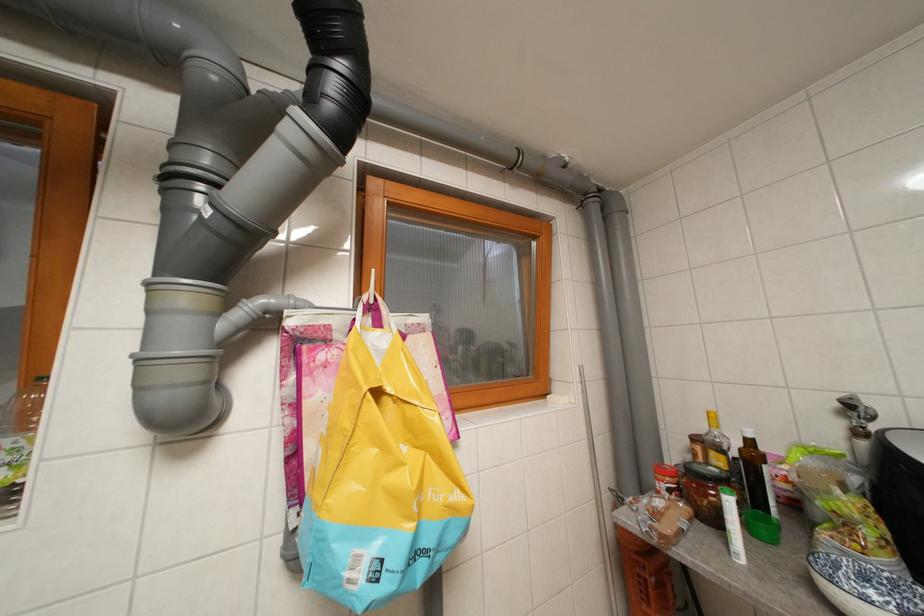
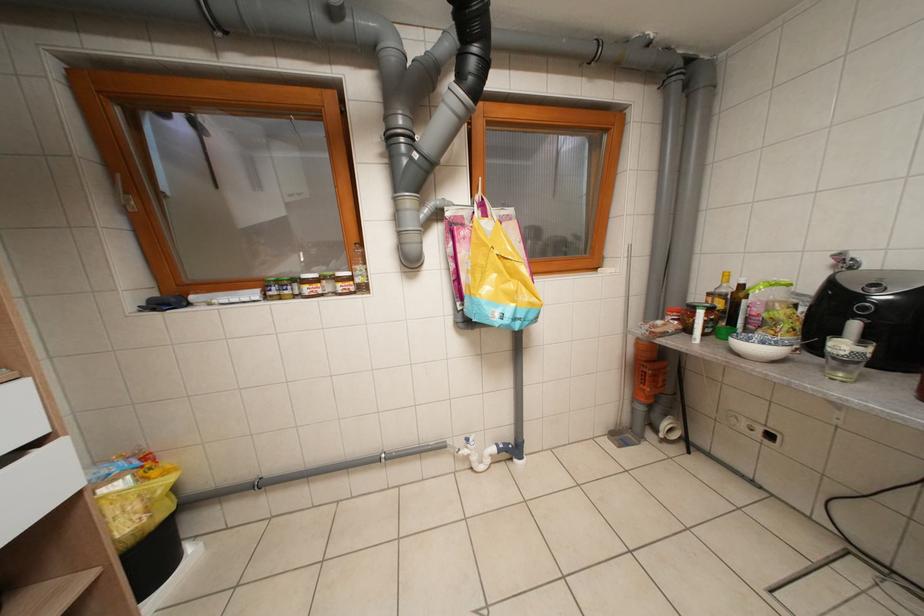
Question: How did the camera likely rotate?

Choices:
 (A) Left
 (B) Right
 (C) Up
 (D) Down

Answer: (D)